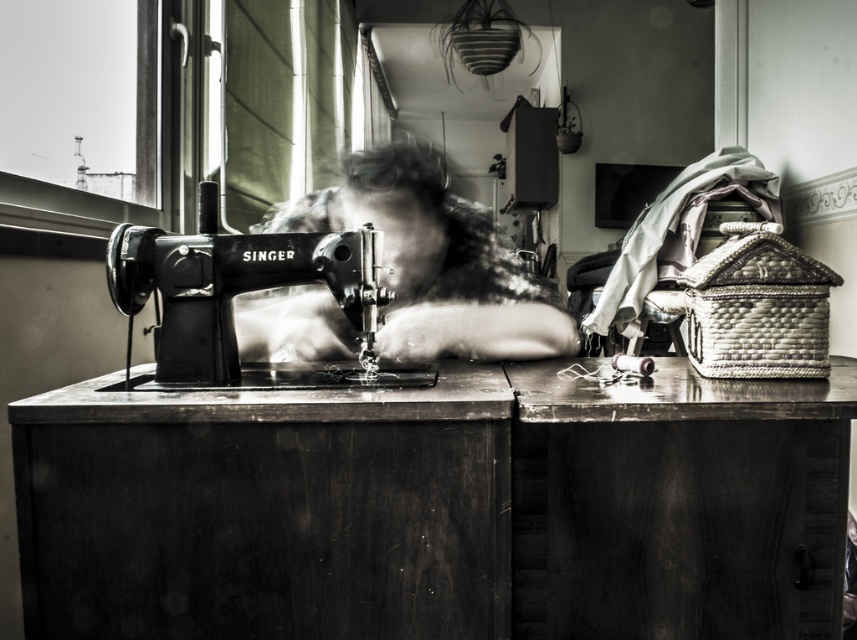
You are organizing a sewing workshop and need to place a new sewing machine on the table. The current metallic singer sewing machine at center is already in use. Where should you place the new machine to avoid blocking the workspace near the wooden table at lower right?

The wooden table at lower right is positioned on the right side of the metallic singer sewing machine at center, so placing the new machine to the left of the existing one would keep it out of the way of the workspace near the wooden table at lower right.

You are standing in front of the wooden table at lower right and want to place a 4 feet long fabric roll on it. Can the fabric roll fit on the table?

The distance between the wooden table at lower right and the camera is 3.98 feet. Since the fabric roll is 4 feet long, it might not fit entirely on the table unless there is enough space along its length. However, the provided information only specifies the distance from the camera, not the table dimensions. Therefore, we cannot determine if the fabric roll will fit based on the given details.